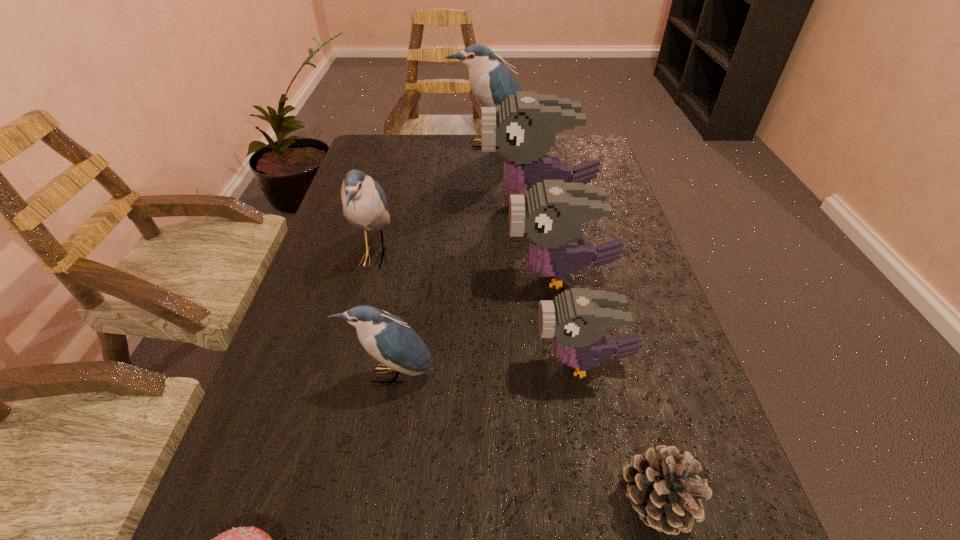
Image resolution: width=960 pixels, height=540 pixels. In order to click on vacant space situated 0.310m at the beak of the farthest gray bird in this screenshot , I will do `click(367, 200)`.

Identify the location of free spot located 0.380m at the beak of the farthest gray bird. The height and width of the screenshot is (540, 960). (341, 200).

Find the location of a particular element. The image size is (960, 540). free location located 0.200m at the tip of the second nearest blue bird's beak is located at coordinates (478, 256).

The height and width of the screenshot is (540, 960). What are the coordinates of `blank space located at the beak of the second farthest gray bird` in the screenshot? It's located at (354, 275).

Where is `free space located 0.210m at the beak of the second farthest gray bird`? Image resolution: width=960 pixels, height=540 pixels. free space located 0.210m at the beak of the second farthest gray bird is located at coordinates (413, 275).

Where is `vacant space located at the beak of the second farthest gray bird`? This screenshot has height=540, width=960. vacant space located at the beak of the second farthest gray bird is located at coordinates (444, 275).

Image resolution: width=960 pixels, height=540 pixels. What are the coordinates of `vacant space situated 0.130m at the tip of the nearest blue bird's beak` in the screenshot? It's located at (376, 465).

The width and height of the screenshot is (960, 540). I want to click on vacant space located 0.240m at the beak of the smallest gray bird, so click(405, 362).

Where is `vacant space located 0.220m at the beak of the smallest gray bird`? This screenshot has height=540, width=960. vacant space located 0.220m at the beak of the smallest gray bird is located at coordinates (416, 362).

Identify the location of free space located at the beak of the smallest gray bird. (475, 362).